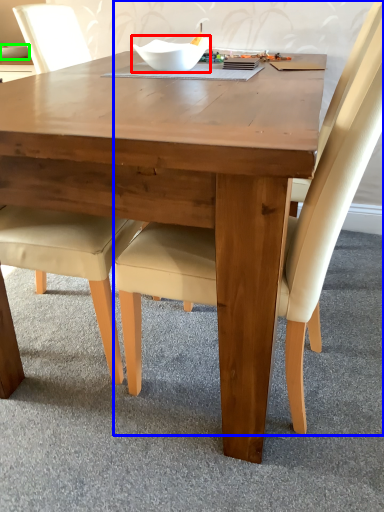
Question: Which object is the closest to the bowl (highlighted by a red box)? Choose among these: chair (highlighted by a blue box) or glass bowl (highlighted by a green box).

Choices:
 (A) chair
 (B) glass bowl

Answer: (A)